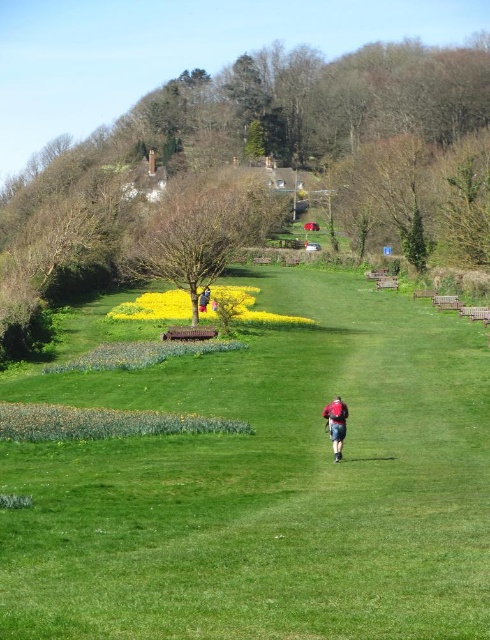
Is bare wood tree at center to the left of red fabric shirt at center from the viewer's perspective?

Indeed, bare wood tree at center is positioned on the left side of red fabric shirt at center.

Does bare wood tree at center appear over red fabric shirt at center?

Yes, bare wood tree at center is above red fabric shirt at center.

Find the location of `bare wood tree at center`. bare wood tree at center is located at coordinates (199, 228).

What do you see at coordinates (267, 486) in the screenshot? Image resolution: width=490 pixels, height=640 pixels. I see `green grassy at center` at bounding box center [267, 486].

Is green grassy at center above green leafy tree at center?

Incorrect, green grassy at center is not positioned above green leafy tree at center.

Describe the element at coordinates (267, 486) in the screenshot. I see `green grassy at center` at that location.

Where is `green grassy at center`? The image size is (490, 640). green grassy at center is located at coordinates click(x=267, y=486).

Is point (368, 324) farther from viewer compared to point (229, 198)?

No, it is in front of (229, 198).

Does point (354, 600) lie in front of point (148, 232)?

Yes.

This screenshot has height=640, width=490. What are the coordinates of `green grassy at center` in the screenshot? It's located at (267, 486).